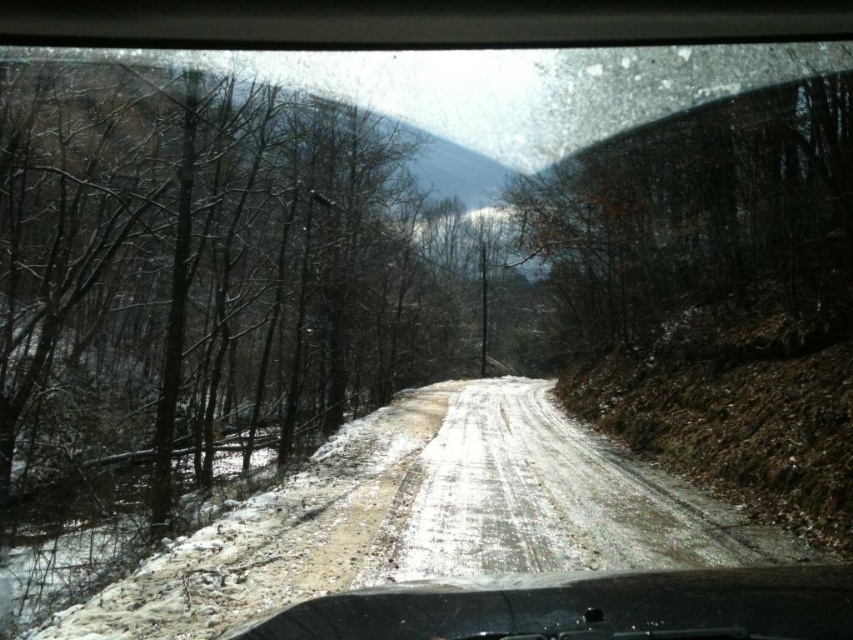
Is smooth bark tree at left to the left of brown matte tree at upper right from the viewer's perspective?

Indeed, smooth bark tree at left is positioned on the left side of brown matte tree at upper right.

Is the position of smooth bark tree at left more distant than that of brown matte tree at upper right?

No, smooth bark tree at left is closer to the viewer.

Is point (248, 424) closer to camera compared to point (619, 202)?

No, it is not.

In order to click on smooth bark tree at left in this screenshot , I will do `click(195, 278)`.

Does sandy dirt road at center have a greater height compared to black rubber dashboard at bottom?

Incorrect, sandy dirt road at center's height is not larger of black rubber dashboard at bottom's.

Which of these two, sandy dirt road at center or black rubber dashboard at bottom, stands taller?

Standing taller between the two is black rubber dashboard at bottom.

You are a GUI agent. You are given a task and a screenshot of the screen. Output one action in this format:
    pyautogui.click(x=<x>, y=<y>)
    Task: Click on the sandy dirt road at center
    This screenshot has height=640, width=853.
    Given the screenshot: What is the action you would take?
    pyautogui.click(x=548, y=500)

Find the location of a particular element. sandy dirt road at center is located at coordinates (548, 500).

In the scene shown: Is brown matte tree at upper right positioned at the back of black rubber dashboard at bottom?

Yes, brown matte tree at upper right is further from the viewer.

Does brown matte tree at upper right appear under black rubber dashboard at bottom?

Incorrect, brown matte tree at upper right is not positioned below black rubber dashboard at bottom.

Where is `brown matte tree at upper right`? The height and width of the screenshot is (640, 853). brown matte tree at upper right is located at coordinates point(697,216).